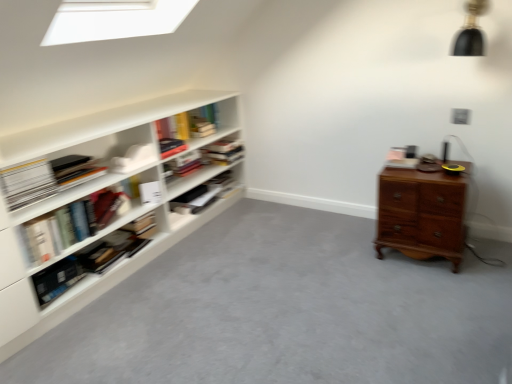
Question: From a real-world perspective, is hardcover books at center, which ranks as the fifth book in bottom-to-top order, located beneath wooden chest of drawers at right?

Choices:
 (A) yes
 (B) no

Answer: (B)

Question: Does hardcover books at center, placed as the first book when sorted from top to bottom, have a greater width compared to wooden chest of drawers at right?

Choices:
 (A) no
 (B) yes

Answer: (A)

Question: Is hardcover books at center, which ranks as the fifth book in bottom-to-top order, oriented towards wooden chest of drawers at right?

Choices:
 (A) yes
 (B) no

Answer: (A)

Question: Does hardcover books at center, which ranks as the fifth book in bottom-to-top order, appear on the right side of wooden chest of drawers at right?

Choices:
 (A) yes
 (B) no

Answer: (B)

Question: Is hardcover books at center, placed as the first book when sorted from top to bottom, behind wooden chest of drawers at right?

Choices:
 (A) no
 (B) yes

Answer: (B)

Question: Considering the relative positions of hardcover books at center, placed as the first book when sorted from top to bottom, and wooden chest of drawers at right in the image provided, is hardcover books at center, placed as the first book when sorted from top to bottom, to the left of wooden chest of drawers at right from the viewer's perspective?

Choices:
 (A) yes
 (B) no

Answer: (A)

Question: Does white matte bookshelf at left, arranged as the second shelf when ordered from the bottom, have a greater width compared to hardcover book at left, positioned as the fourth book in top-to-bottom order?

Choices:
 (A) yes
 (B) no

Answer: (A)

Question: Is white matte bookshelf at left, which is the 1th shelf from top to bottom, facing away from hardcover book at left, which is counted as the second book, starting from the bottom?

Choices:
 (A) no
 (B) yes

Answer: (B)

Question: Does white matte bookshelf at left, arranged as the second shelf when ordered from the bottom, have a lesser width compared to hardcover book at left, positioned as the fourth book in top-to-bottom order?

Choices:
 (A) yes
 (B) no

Answer: (B)

Question: Does white matte bookshelf at left, arranged as the second shelf when ordered from the bottom, have a smaller size compared to hardcover book at left, positioned as the fourth book in top-to-bottom order?

Choices:
 (A) yes
 (B) no

Answer: (B)

Question: Is white matte bookshelf at left, arranged as the second shelf when ordered from the bottom, next to hardcover book at left, positioned as the fourth book in top-to-bottom order, and touching it?

Choices:
 (A) yes
 (B) no

Answer: (B)

Question: Does white matte book at left, acting as the 2th paperback book starting from the right, have a lesser width compared to wooden chest of drawers at right?

Choices:
 (A) yes
 (B) no

Answer: (A)